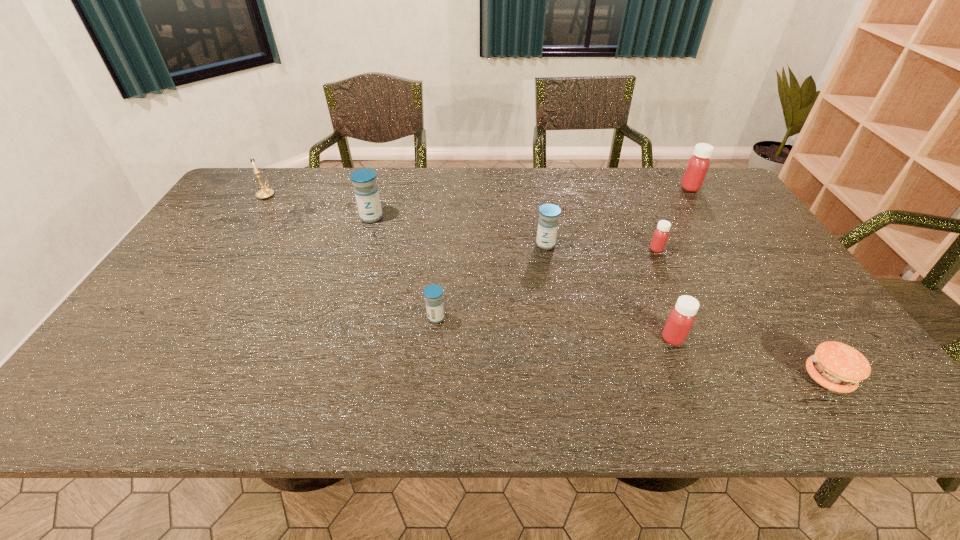
Locate an element on the screen. the rightmost medicine is located at coordinates (698, 164).

You are a GUI agent. You are given a task and a screenshot of the screen. Output one action in this format:
    pyautogui.click(x=<x>, y=<y>)
    Task: Click on the farthest medicine
    Image resolution: width=960 pixels, height=540 pixels.
    Given the screenshot: What is the action you would take?
    pyautogui.click(x=698, y=164)

You are a GUI agent. You are given a task and a screenshot of the screen. Output one action in this format:
    pyautogui.click(x=<x>, y=<y>)
    Task: Click on the third farthest object
    
    Given the screenshot: What is the action you would take?
    pyautogui.click(x=366, y=191)

Where is `the second object from left to right`? the second object from left to right is located at coordinates (366, 191).

Locate an element on the screen. This screenshot has height=540, width=960. candle holder is located at coordinates (265, 193).

Where is `the leftmost object`? The height and width of the screenshot is (540, 960). the leftmost object is located at coordinates (265, 193).

Locate an element on the screen. The width and height of the screenshot is (960, 540). the fourth object from left to right is located at coordinates (548, 222).

You are a GUI agent. You are given a task and a screenshot of the screen. Output one action in this format:
    pyautogui.click(x=<x>, y=<y>)
    Task: Click on the rightmost blue medicine
    Image resolution: width=960 pixels, height=540 pixels.
    Given the screenshot: What is the action you would take?
    pyautogui.click(x=548, y=222)

Find the location of `the second biggest red medicine`. the second biggest red medicine is located at coordinates (681, 318).

Find the location of a particular element. the third medicine from right to left is located at coordinates (681, 318).